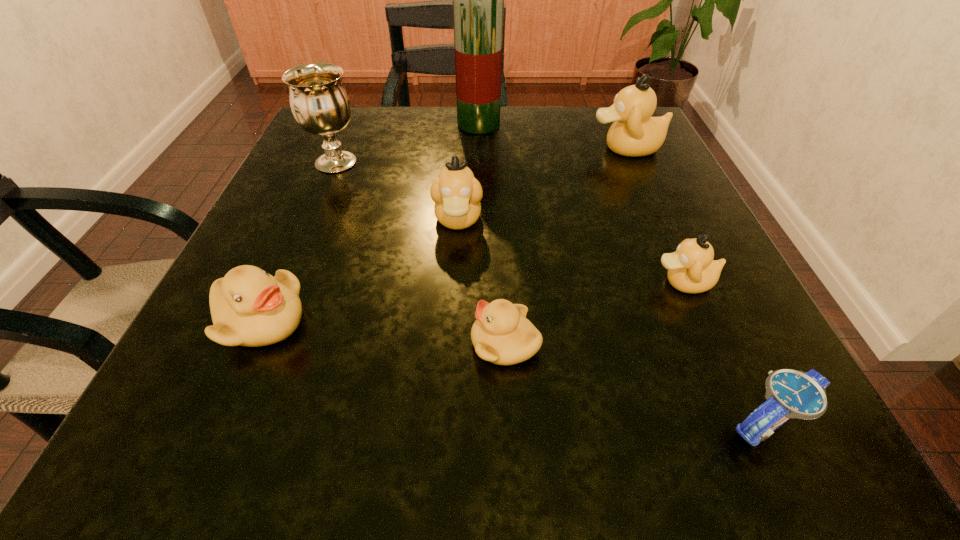
Find the location of `tan duckling that is the nearest to the chalice`. tan duckling that is the nearest to the chalice is located at coordinates (456, 192).

At what (x,y) coordinates should I click in order to perform the action: click on free space that satisfies the following two spatial constraints: 1. on the face of the second farthest duckling; 2. on the left side of the nearest object. Please return your answer as a coordinate pair (x, y). The image size is (960, 540). Looking at the image, I should click on (446, 423).

This screenshot has width=960, height=540. What are the coordinates of `vacant region that satisfies the following two spatial constraints: 1. on the beak of the smaller yellow duckling; 2. on the left side of the nearest object` in the screenshot? It's located at (509, 423).

Find the location of a particular element. The height and width of the screenshot is (540, 960). free point that satisfies the following two spatial constraints: 1. on the face of the blue watch; 2. on the left side of the third tallest object is located at coordinates (748, 423).